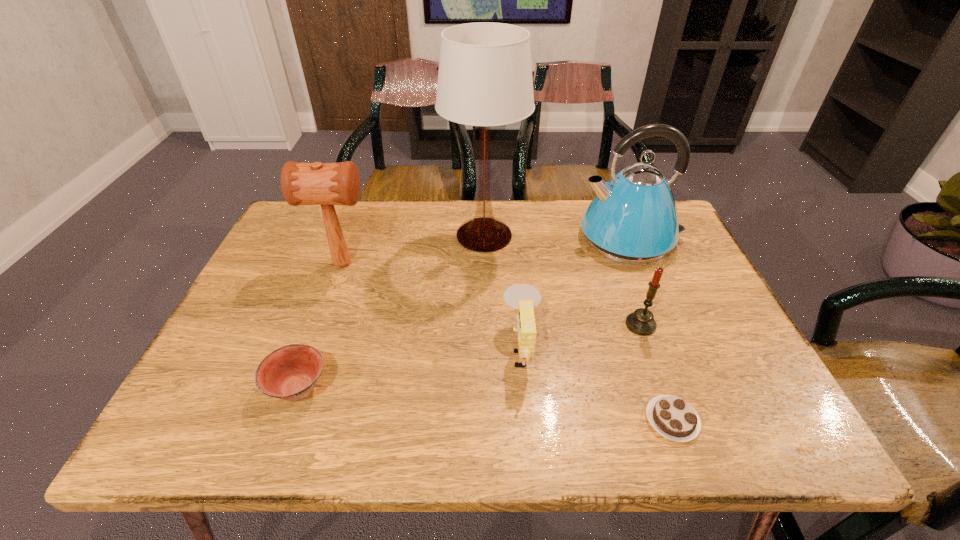
The width and height of the screenshot is (960, 540). I want to click on the tallest object, so click(485, 74).

The image size is (960, 540). Identify the location of kettle. (633, 219).

At what (x,y) coordinates should I click in order to perform the action: click on mallet. Please return your answer as a coordinate pair (x, y). The image size is (960, 540). Looking at the image, I should click on (327, 184).

Find the location of a particular element. This screenshot has height=540, width=960. the fourth shortest object is located at coordinates (641, 322).

This screenshot has width=960, height=540. I want to click on sponge, so click(523, 297).

Locate an element on the screen. the sixth tallest object is located at coordinates (290, 373).

I want to click on chocolate cake, so click(x=672, y=417).

I want to click on free space located 0.050m above the cylindrical shade of the tallest object, so click(426, 235).

You are a GUI agent. You are given a task and a screenshot of the screen. Output one action in this format:
    pyautogui.click(x=<x>, y=<y>)
    Task: Click on the vacant space situated above the cylindrical shade of the tallest object
    
    Given the screenshot: What is the action you would take?
    pyautogui.click(x=422, y=235)

I want to click on vacant space located 0.140m above the cylindrical shade of the tallest object, so click(x=396, y=235).